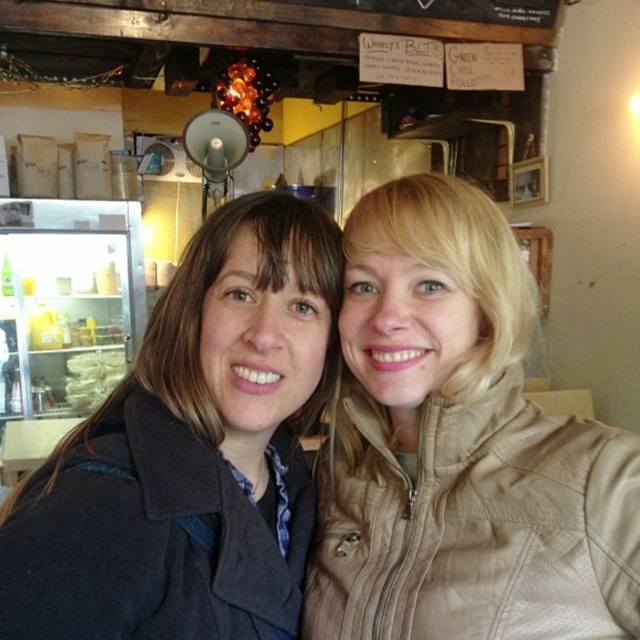
Can you confirm if tan leather jacket at center is positioned above dark blue wool coat at center?

Yes.

The height and width of the screenshot is (640, 640). Identify the location of tan leather jacket at center. pos(460,445).